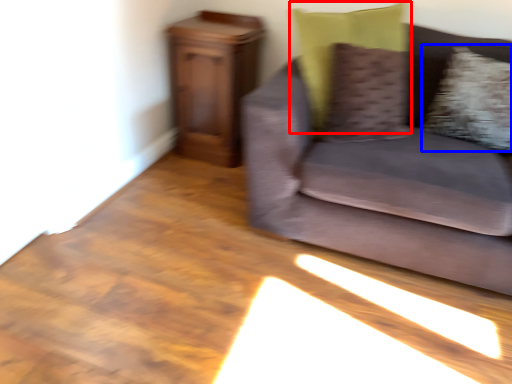
Question: Which object appears closest to the camera in this image, pillow (highlighted by a red box) or pillow (highlighted by a blue box)?

Choices:
 (A) pillow
 (B) pillow

Answer: (A)